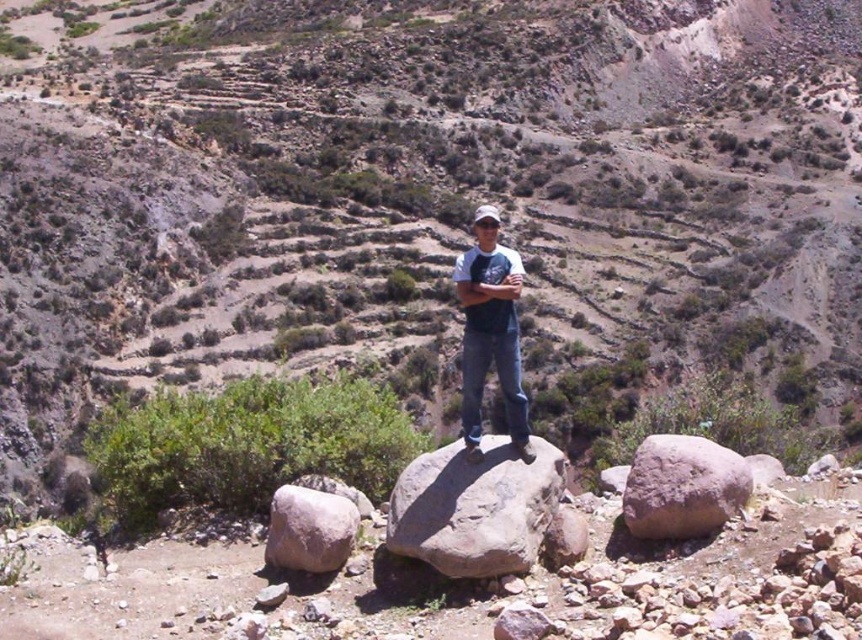
Question: Which point is farther to the camera?

Choices:
 (A) gray rough rock at center
 (B) denim jeans at center
 (C) brown rough rock at lower left

Answer: (B)

Question: Which object is the closest to the brown rough rock at center?

Choices:
 (A) white matte baseball hat at center
 (B) gray rough rock at center
 (C) brown rough rock at lower left

Answer: (B)

Question: Is brown rough rock at center bigger than white matte baseball hat at center?

Choices:
 (A) no
 (B) yes

Answer: (A)

Question: Does denim jeans at center have a greater width compared to brown rough rock at lower left?

Choices:
 (A) no
 (B) yes

Answer: (A)

Question: Can you confirm if brown rough rock at lower left is bigger than white matte baseball hat at center?

Choices:
 (A) no
 (B) yes

Answer: (A)

Question: Considering the real-world distances, which object is farthest from the brown rough rock at center?

Choices:
 (A) brown rough rock at lower left
 (B) gray rough rock at center
 (C) denim jeans at center

Answer: (A)